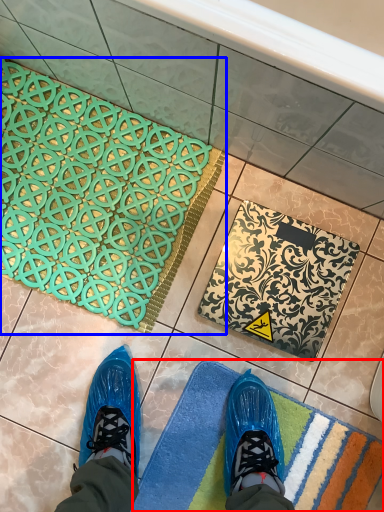
Question: Among these objects, which one is nearest to the camera, bath mat (highlighted by a red box) or bath mat (highlighted by a blue box)?

Choices:
 (A) bath mat
 (B) bath mat

Answer: (A)